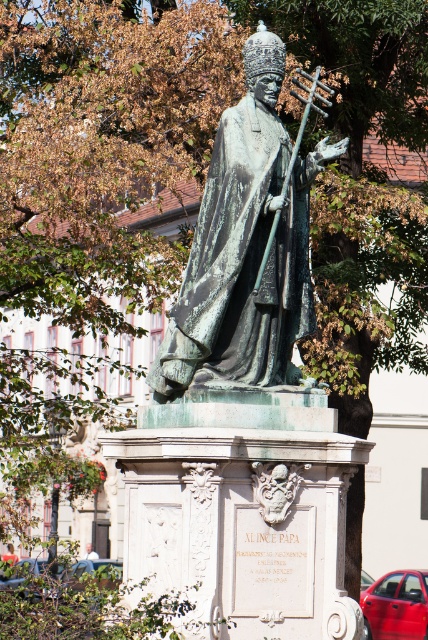
Who is positioned more to the right, green patina statue at center or red fabric umbrella at lower left?

green patina statue at center

Between green patina statue at center and red fabric umbrella at lower left, which one has more height?

With more height is green patina statue at center.

Does point (256, 333) come farther from viewer compared to point (11, 556)?

No, it is not.

Locate an element on the screen. The height and width of the screenshot is (640, 428). green patina statue at center is located at coordinates (246, 246).

Between red fabric umbrella at lower left and light brown wooden chair at center, which one has more height?

With more height is red fabric umbrella at lower left.

Is the position of red fabric umbrella at lower left more distant than that of light brown wooden chair at center?

No, red fabric umbrella at lower left is closer to the viewer.

Locate an element on the screen. Image resolution: width=428 pixels, height=640 pixels. red fabric umbrella at lower left is located at coordinates (9, 554).

Is green patina statue at center thinner than light brown wooden chair at center?

No, green patina statue at center is not thinner than light brown wooden chair at center.

Does green patina statue at center have a lesser height compared to light brown wooden chair at center?

Incorrect, green patina statue at center's height does not fall short of light brown wooden chair at center's.

Is point (187, 285) closer to viewer compared to point (89, 557)?

That is True.

Identify the location of green patina statue at center. The image size is (428, 640). (246, 246).